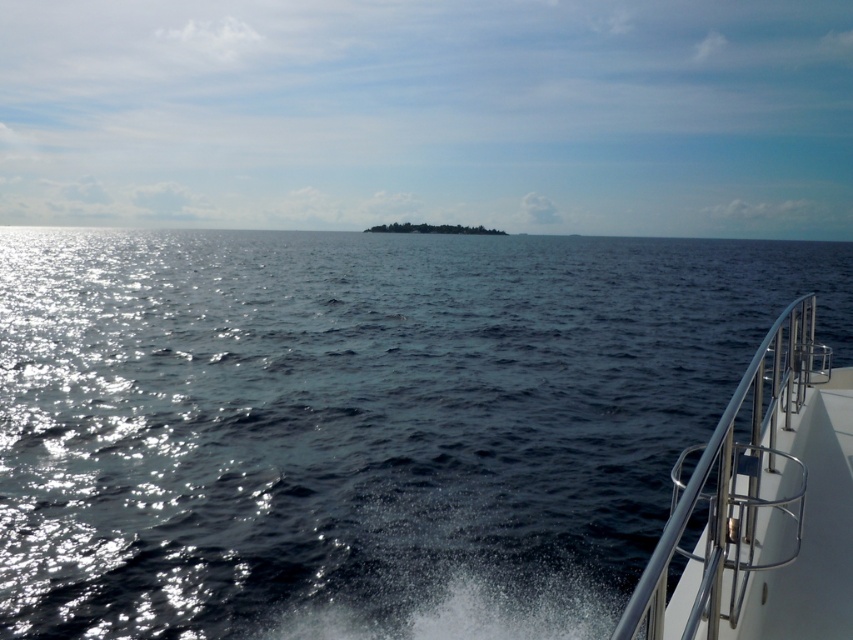
You are standing on the boat deck and want to locate the glistening blue water at center. According to the coordinates provided, what are the exact coordinates where you should look to find it?

The glistening blue water at center is located at the coordinates point [361,422].

You are standing on the deck of the boat and looking out at the ocean. There are two points marked on the deck. The first point is at coordinates point [540,620] and the second is at point [698,577]. Which point is closer to the horizon?

Point [540,620] is behind point [698,577], so the point closer to the horizon would be point [698,577] since it is in front.